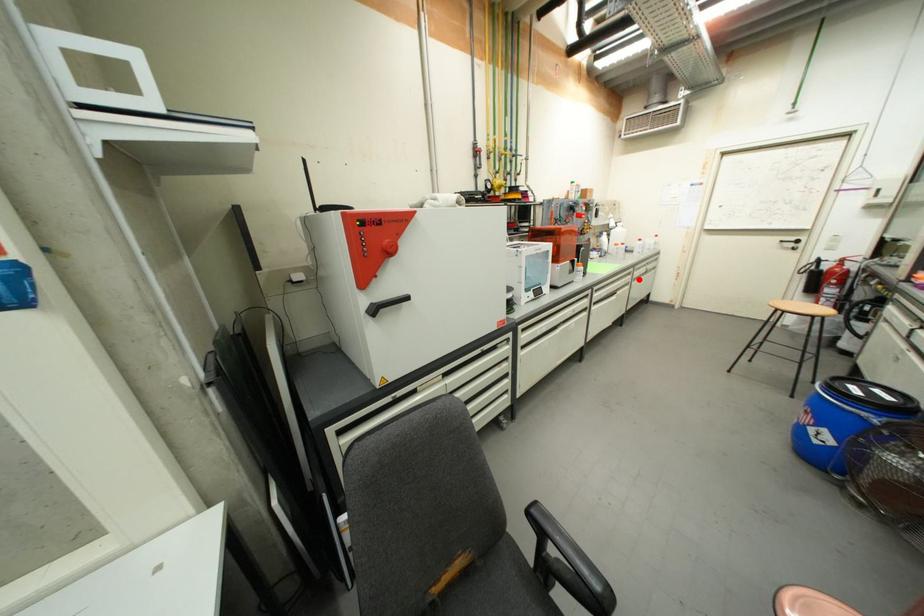
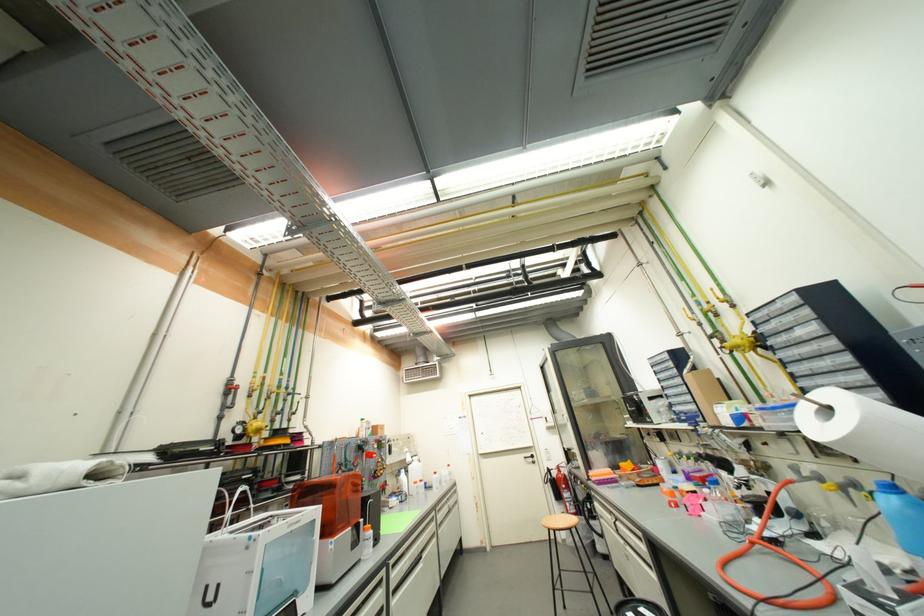
The point at the highlighted location is marked in the first image. Where is the corresponding point in the second image?

(444, 525)